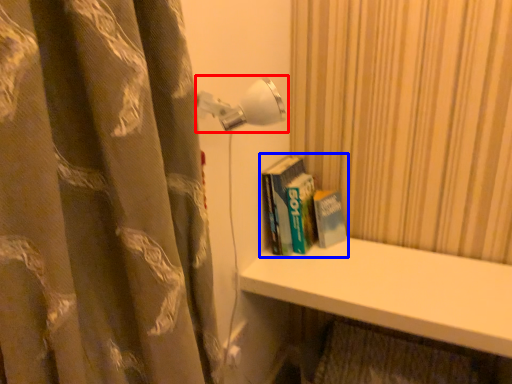
Question: Which point is closer to the camera, lamp (highlighted by a red box) or book (highlighted by a blue box)?

Choices:
 (A) lamp
 (B) book

Answer: (A)